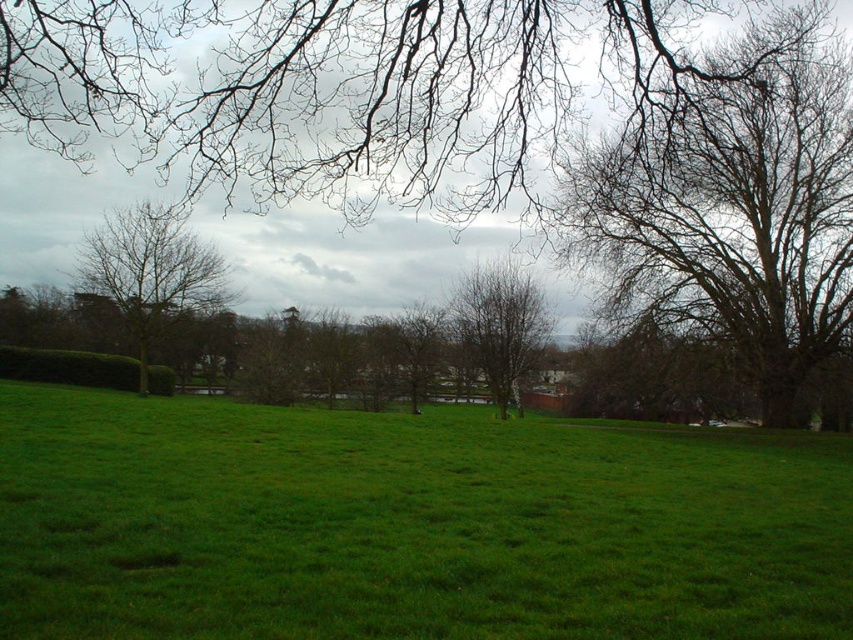
Question: In this image, where is bare branches at upper center located relative to bare branches at upper right?

Choices:
 (A) below
 (B) above

Answer: (B)

Question: Among these points, which one is nearest to the camera?

Choices:
 (A) (149, 32)
 (B) (723, 96)
 (C) (126, 305)

Answer: (A)

Question: Considering the relative positions of bare branches at left and brown textured tree at center in the image provided, where is bare branches at left located with respect to brown textured tree at center?

Choices:
 (A) left
 (B) right

Answer: (A)

Question: Is bare branches at upper center positioned in front of bare branches at left?

Choices:
 (A) no
 (B) yes

Answer: (B)

Question: Which of these objects is positioned closest to the bare branches at upper center?

Choices:
 (A) green grassy field at center
 (B) brown textured tree at center

Answer: (A)

Question: Which of the following is the farthest from the observer?

Choices:
 (A) (399, 616)
 (B) (810, 266)

Answer: (B)